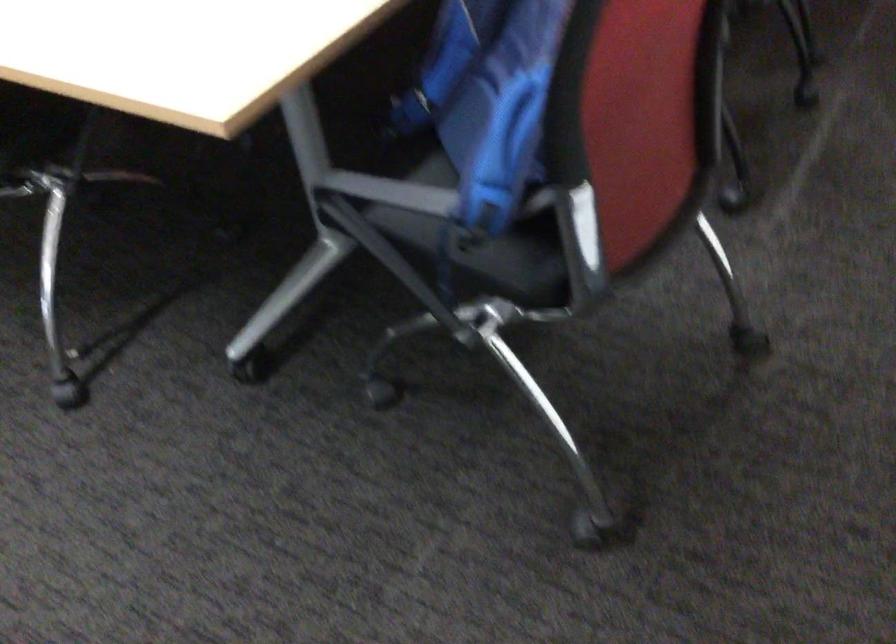
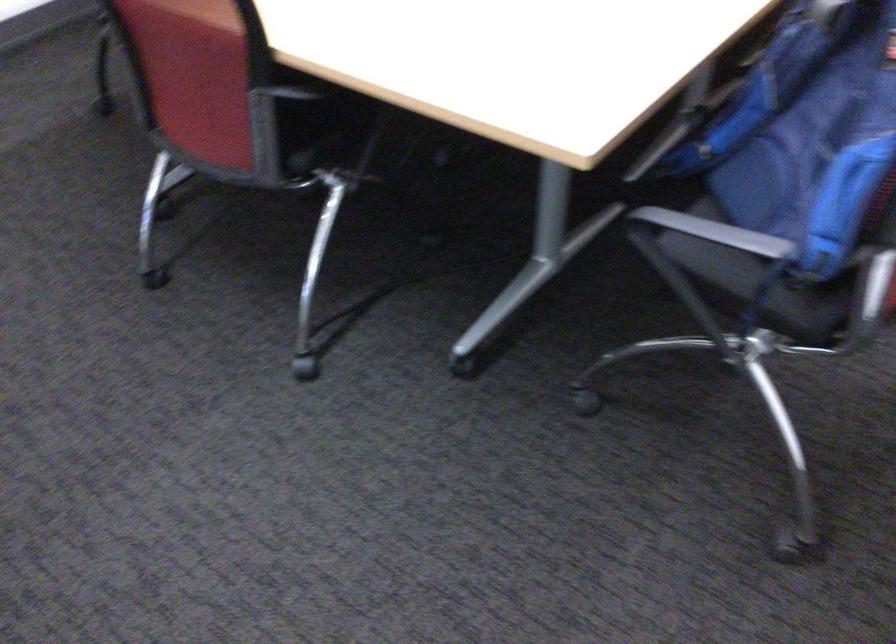
Find the pixel in the second image that matches the point at 394,189 in the first image.

(716, 232)